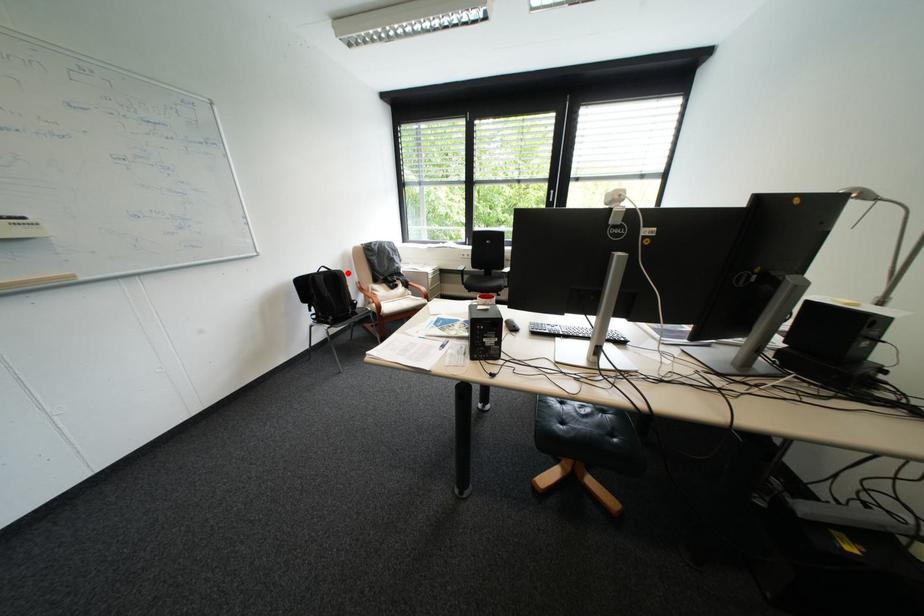
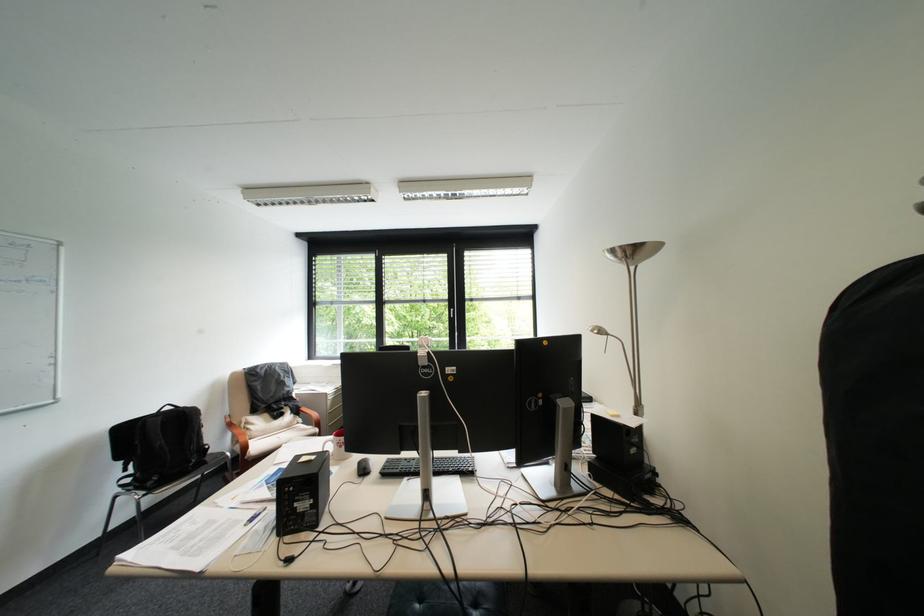
Question: I am providing you with two images of the same scene from different viewpoints. In image1, a red point is highlighted. Considering the same 3D point in image2, which of the following is correct?

Choices:
 (A) It is closer
 (B) It is farther

Answer: (B)